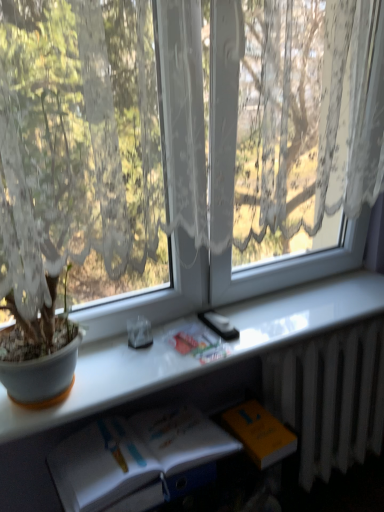
Question: Is transparent lace curtain at upper center taller or shorter than white metallic radiator at lower right?

Choices:
 (A) tall
 (B) short

Answer: (A)

Question: From the image's perspective, is transparent lace curtain at upper center above or below white metallic radiator at lower right?

Choices:
 (A) below
 (B) above

Answer: (B)

Question: Which object is positioned farthest from the white metallic radiator at lower right?

Choices:
 (A) orange matte paperback book at lower right
 (B) white glossy book at lower center
 (C) transparent lace curtain at upper center
 (D) matte plastic book at center, marked as the 2th book in a bottom-to-top arrangement
 (E) white paper book at lower center, acting as the 1th book starting from the bottom

Answer: (C)

Question: Estimate the real-world distances between objects in this image. Which object is closer to the transparent lace curtain at upper center?

Choices:
 (A) orange matte paperback book at lower right
 (B) matte plastic book at center, marked as the 2th book in a bottom-to-top arrangement
 (C) white glossy book at lower center
 (D) white paper book at lower center, acting as the 1th book starting from the bottom
 (E) white metallic radiator at lower right

Answer: (C)